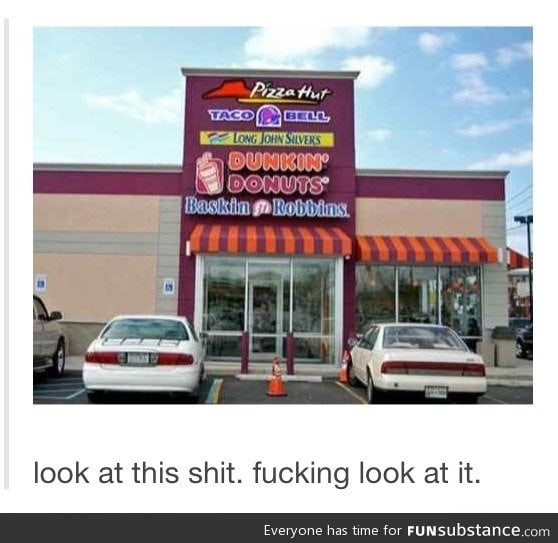
Locate an element on the screen. This screenshot has height=543, width=558. windows is located at coordinates (229, 299), (266, 299), (305, 301), (368, 303), (421, 301), (461, 301).